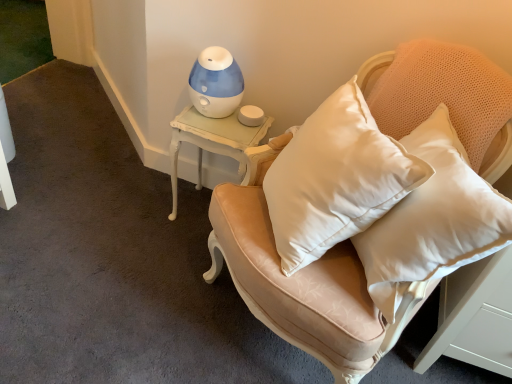
Question: From a real-world perspective, is blue plastic humidifier at upper center positioned above or below satin beige armchair at center?

Choices:
 (A) above
 (B) below

Answer: (A)

Question: Visually, is blue plastic humidifier at upper center positioned to the left or to the right of satin beige armchair at center?

Choices:
 (A) right
 (B) left

Answer: (B)

Question: Considering the real-world distances, which object is closest to the satin beige armchair at center?

Choices:
 (A) white painted wood side table at upper left
 (B) blue plastic humidifier at upper center

Answer: (A)

Question: Estimate the real-world distances between objects in this image. Which object is farther from the satin beige armchair at center?

Choices:
 (A) white painted wood side table at upper left
 (B) blue plastic humidifier at upper center

Answer: (B)